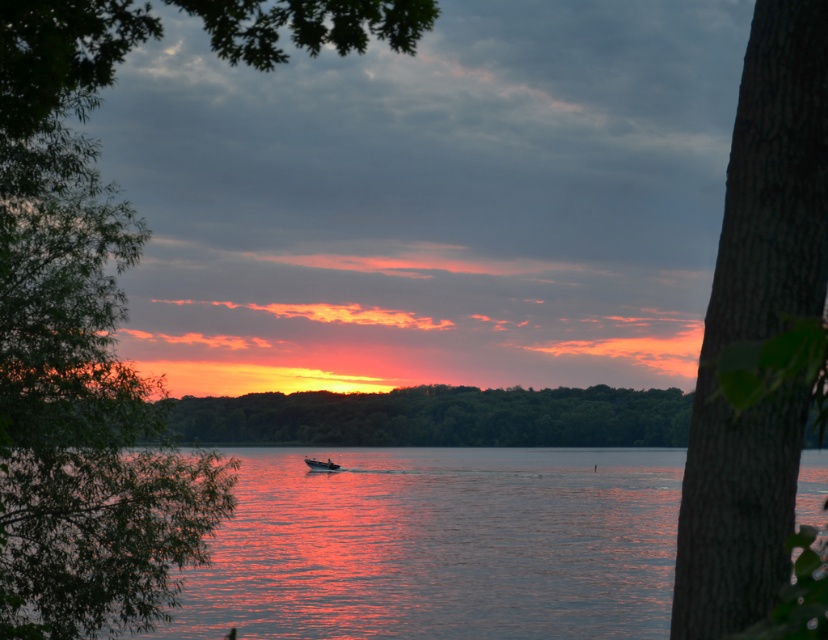
You are standing on the dock and want to take a photo of both the green leafy tree at center and the metallic silver boat at center. Which object should you position to your left to include both in the frame?

Since the green leafy tree at center is to the right of the metallic silver boat at center, you should position the metallic silver boat at center to your left to include both in the frame.